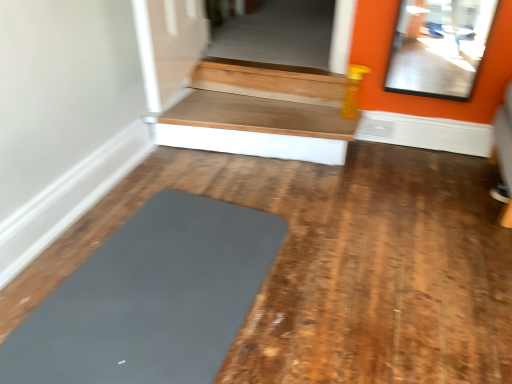
You are a GUI agent. You are given a task and a screenshot of the screen. Output one action in this format:
    pyautogui.click(x=<x>, y=<y>)
    Task: Click on the vacant space to the right of matte gray yoga mat at center
    
    Given the screenshot: What is the action you would take?
    pyautogui.click(x=366, y=300)